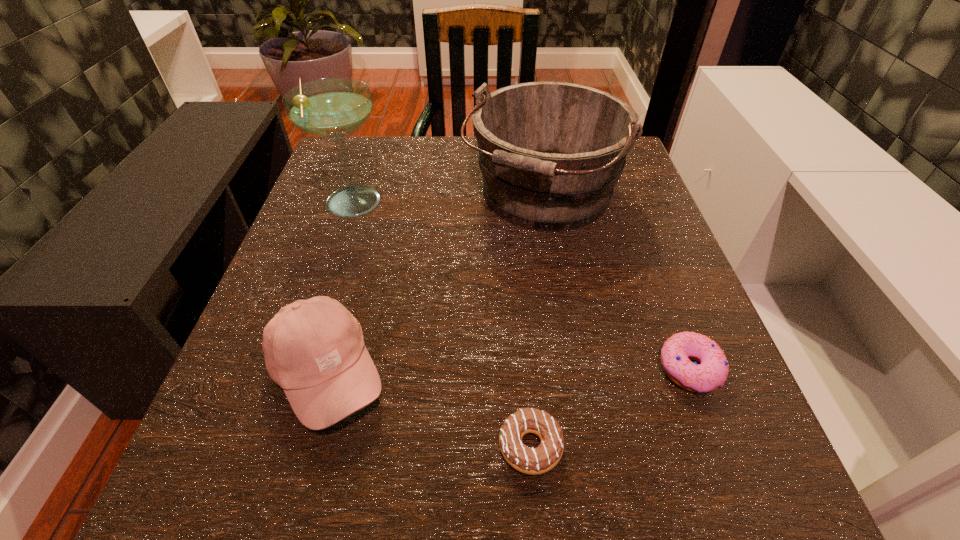
Identify the location of object present at the far right corner. The image size is (960, 540). coord(550,153).

In the image, there is a desktop. Where is `vacant space at the far edge`? The height and width of the screenshot is (540, 960). vacant space at the far edge is located at coordinates (417, 159).

Where is `vacant space at the near edge`? The width and height of the screenshot is (960, 540). vacant space at the near edge is located at coordinates (385, 496).

This screenshot has width=960, height=540. In the image, there is a desktop. Find the location of `vacant space at the left edge`. vacant space at the left edge is located at coordinates (345, 305).

In the image, there is a desktop. Where is `free space at the right edge`? The image size is (960, 540). free space at the right edge is located at coordinates click(640, 274).

Image resolution: width=960 pixels, height=540 pixels. I want to click on vacant space at the far left corner of the desktop, so click(x=390, y=147).

Locate an element on the screen. This screenshot has height=540, width=960. blank space at the near left corner is located at coordinates (172, 513).

This screenshot has height=540, width=960. Find the location of `free space between the third shortest object and the second tallest object`. free space between the third shortest object and the second tallest object is located at coordinates (435, 285).

Identify the location of free space that is in between the baseball cap and the farther doughnut. (509, 371).

Locate an element on the screen. free space that is in between the right doughnut and the second tallest object is located at coordinates (615, 282).